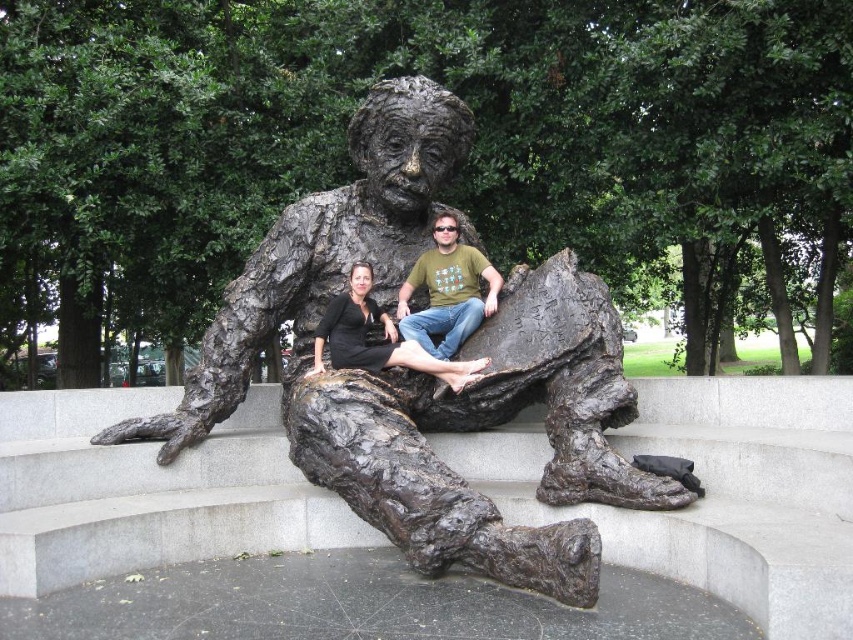
Who is positioned more to the right, matte bronze statue at center or matte black dress at center?

From the viewer's perspective, matte bronze statue at center appears more on the right side.

This screenshot has width=853, height=640. Describe the element at coordinates (447, 291) in the screenshot. I see `matte bronze statue at center` at that location.

Identify the location of matte bronze statue at center. This screenshot has height=640, width=853. (447, 291).

Does bronze statue at center appear over matte black dress at center?

Incorrect, bronze statue at center is not positioned above matte black dress at center.

The height and width of the screenshot is (640, 853). Find the location of `bronze statue at center`. bronze statue at center is located at coordinates (424, 376).

Find the location of a particular element. This screenshot has width=853, height=640. bronze statue at center is located at coordinates coord(424,376).

Is bronze statue at center closer to camera compared to matte bronze statue at center?

Yes, it is in front of matte bronze statue at center.

Can you confirm if bronze statue at center is smaller than matte bronze statue at center?

Actually, bronze statue at center might be larger than matte bronze statue at center.

The height and width of the screenshot is (640, 853). What do you see at coordinates (424, 376) in the screenshot?
I see `bronze statue at center` at bounding box center [424, 376].

The image size is (853, 640). What are the coordinates of `bronze statue at center` in the screenshot? It's located at (424, 376).